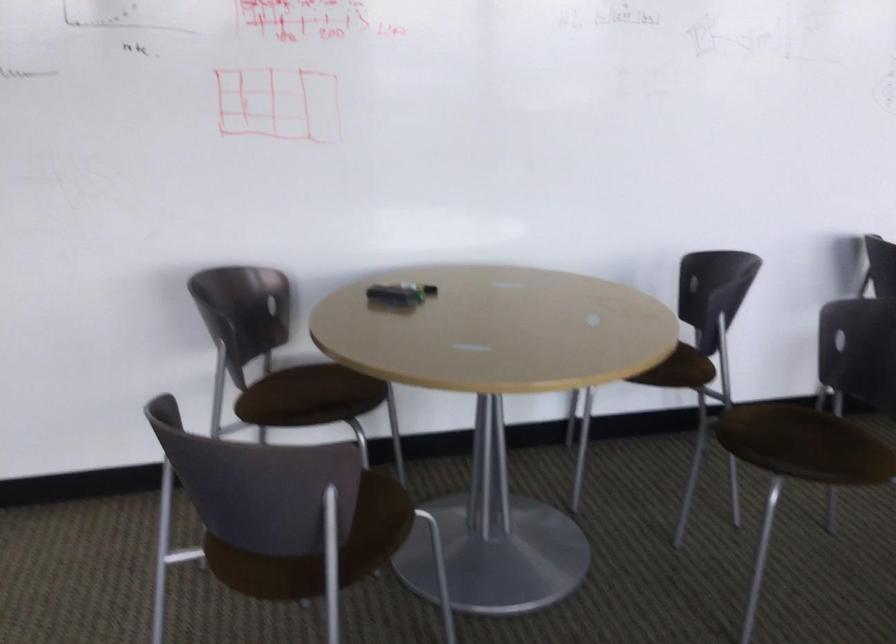
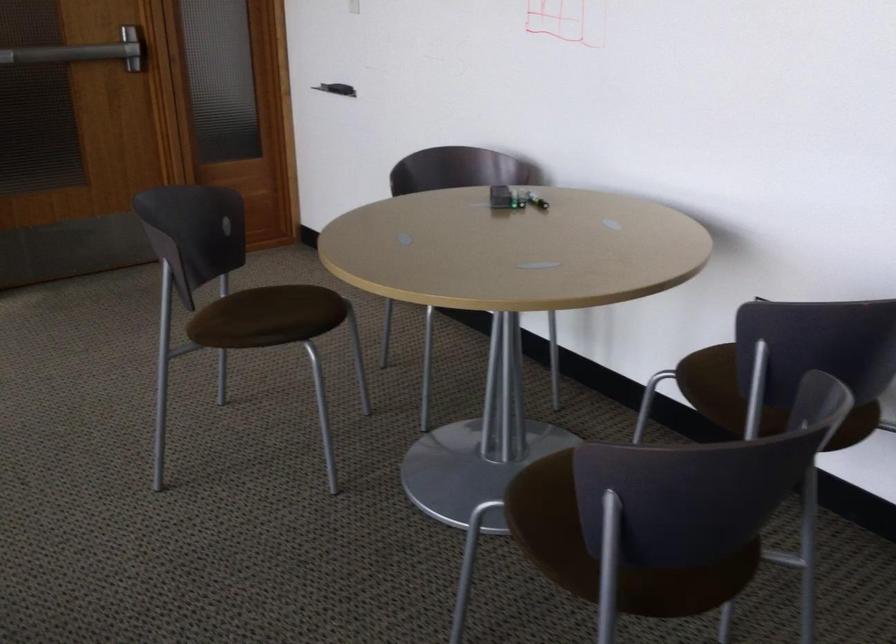
In the second image, find the point that corresponds to (389,299) in the first image.

(498, 198)